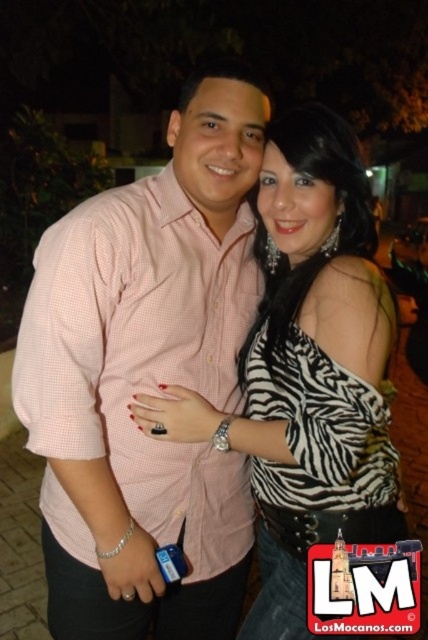
Question: Which point appears closest to the camera in this image?

Choices:
 (A) (264, 314)
 (B) (205, 582)

Answer: (A)

Question: Among these objects, which one is nearest to the camera?

Choices:
 (A) pink checkered shirt at center
 (B) zebra print blouse at center

Answer: (B)

Question: Is pink checkered shirt at center thinner than zebra print blouse at center?

Choices:
 (A) no
 (B) yes

Answer: (B)

Question: Is pink checkered shirt at center bigger than zebra print blouse at center?

Choices:
 (A) no
 (B) yes

Answer: (B)

Question: Can you confirm if pink checkered shirt at center is positioned to the left of zebra print blouse at center?

Choices:
 (A) yes
 (B) no

Answer: (A)